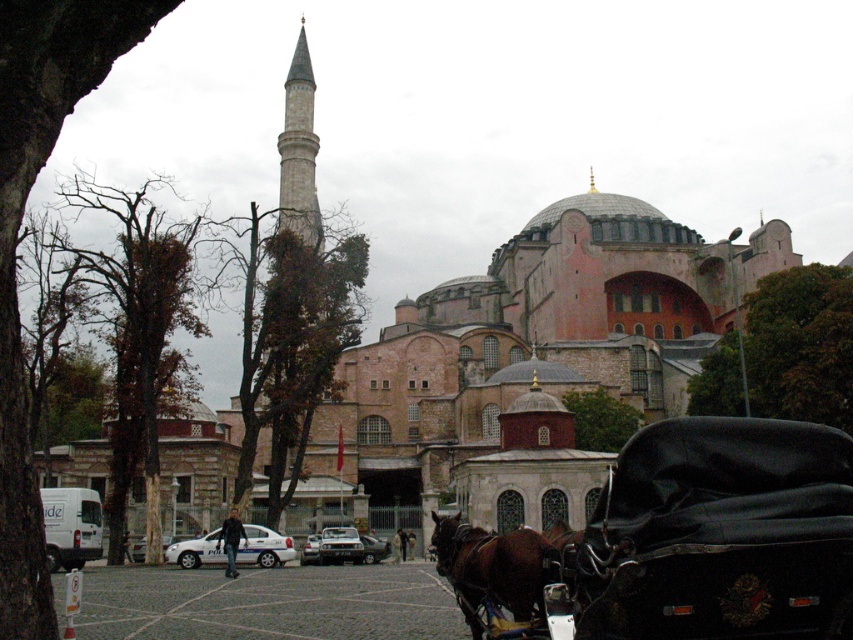
You are a tourist standing in front of the mosque and see the brown glossy horse at lower center and the black leather coach at center. Which object is closer to you?

The brown glossy horse at lower center is closer to you because it is positioned over the black leather coach at center, indicating it is in front.

You are standing in front of the mosque and want to locate two specific points marked in the image. Which of the two points, point 1 at coordinates point (747, 467) or point 2 at coordinates point (230, 576), is closer to you?

Point 1 at coordinates point (747, 467) is closer to the viewer than point 2 at coordinates point (230, 576).